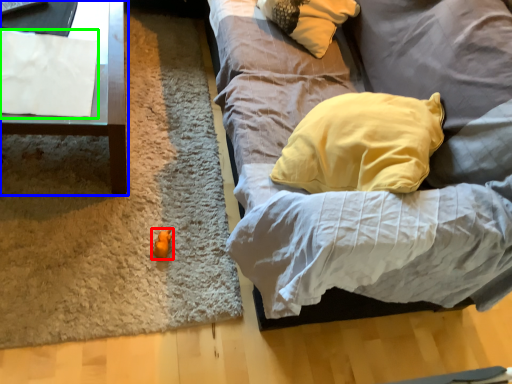
Question: Which object is positioned farthest from toy (highlighted by a red box)? Select from furniture (highlighted by a blue box) and sheet (highlighted by a green box).

Choices:
 (A) furniture
 (B) sheet

Answer: (B)